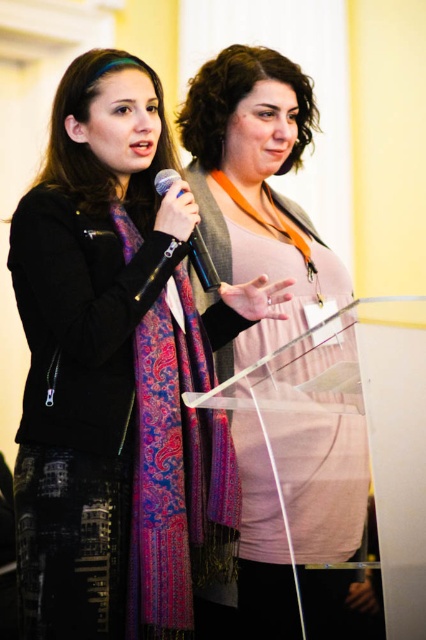
You are standing in front of the podium where the two women are speaking. You need to place a small decorative item on the podium. The podium has a coordinate system where the bottom left corner is the origin. The first point is at position point(313,243) and the second point is at point(195,237). Which point is closer to the front edge of the podium?

Point(195,237) is closer to the front edge of the podium because it is positioned in front of point(313,243).

You are a photographer trying to capture a closeup of the pink fabric at center and the metallic blue microphone at center during the presentation. Which object should you focus on first to ensure it appears larger in the photo?

The pink fabric at center is much taller than the metallic blue microphone at center, so you should focus on the pink fabric at center first to ensure it appears larger in the photo.